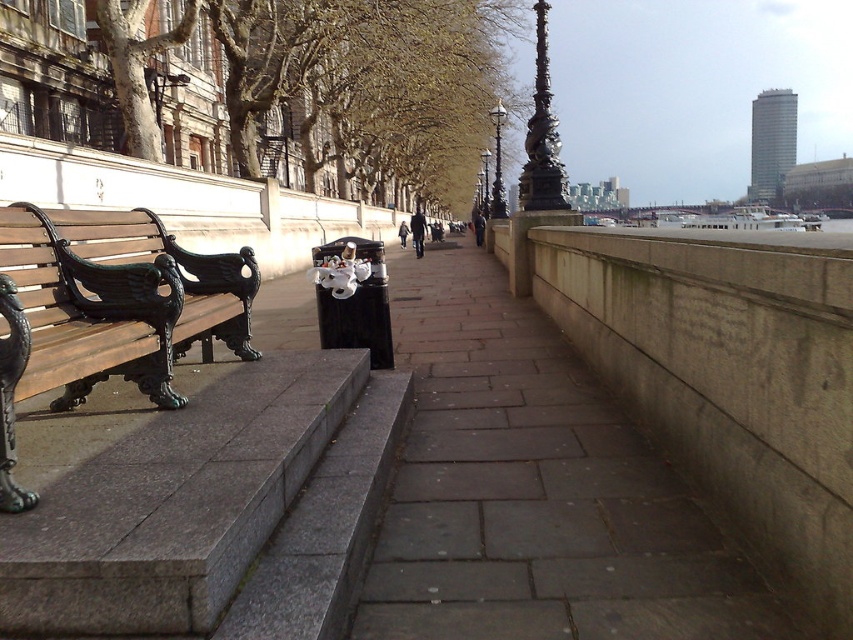
Between gray concrete sidewalk at center and matte brown bench at left, which one has more height?

matte brown bench at left

Which is behind, point (589, 627) or point (135, 358)?

The point (135, 358) is behind.

Who is more distant from viewer, (567, 627) or (105, 326)?

Positioned behind is point (105, 326).

Identify the location of gray concrete sidewalk at center. (535, 492).